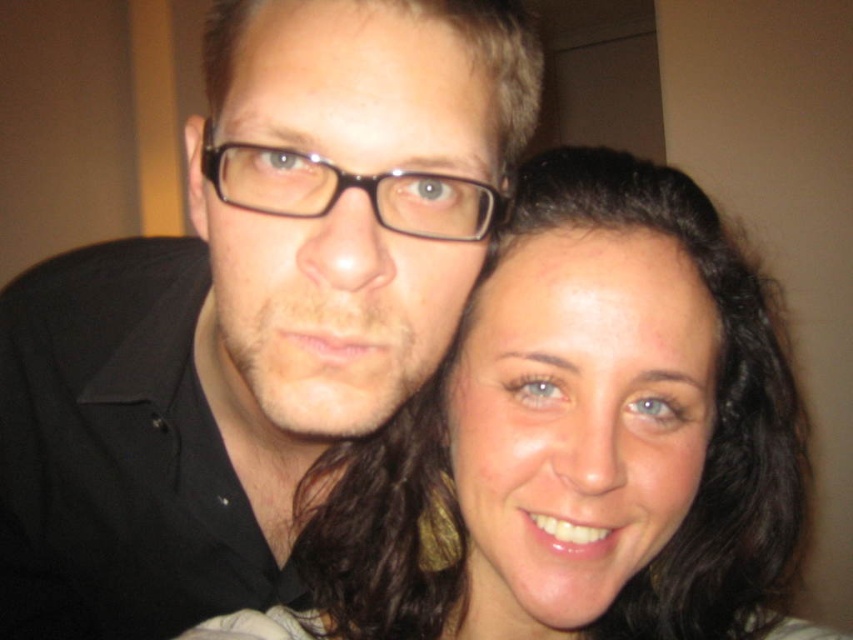
Based on the photo, which is more to the right, matte black shirt at left or black plastic glasses at center?

Positioned to the right is black plastic glasses at center.

Is point (68, 304) positioned after point (282, 193)?

That is True.

Where is `matte black shirt at left`? matte black shirt at left is located at coordinates (252, 308).

Locate an element on the screen. matte black shirt at left is located at coordinates (252, 308).

Who is more distant from viewer, (241, 532) or (474, 403)?

Positioned behind is point (241, 532).

Does matte black shirt at left appear on the right side of matte black hair at center?

In fact, matte black shirt at left is to the left of matte black hair at center.

Who is more forward, (206, 582) or (683, 580)?

Point (683, 580) is more forward.

Locate an element on the screen. The image size is (853, 640). matte black shirt at left is located at coordinates (252, 308).

Is matte black hair at center to the left of black plastic glasses at center from the viewer's perspective?

Incorrect, matte black hair at center is not on the left side of black plastic glasses at center.

Is matte black hair at center shorter than black plastic glasses at center?

No.

Which is behind, point (651, 289) or point (248, 157)?

The point (651, 289) is more distant.

The width and height of the screenshot is (853, 640). Identify the location of matte black hair at center. (577, 442).